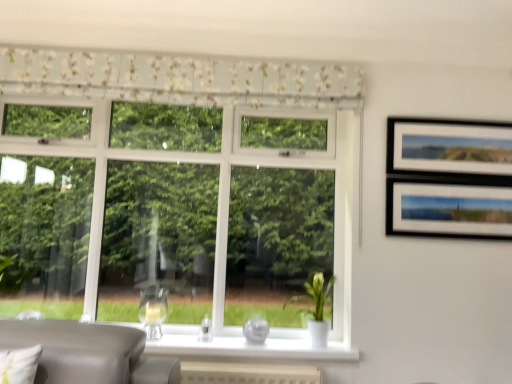
The width and height of the screenshot is (512, 384). Identify the location of blank space situated above floral fabric valance at upper center (from a real-world perspective). (180, 57).